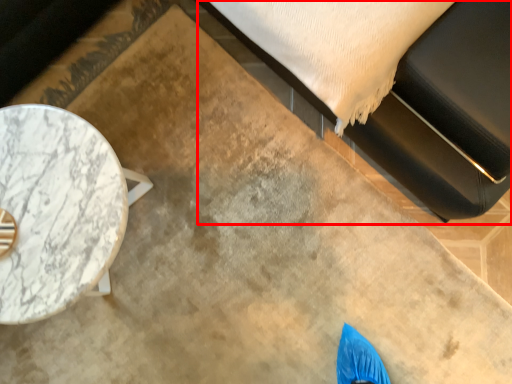
Question: From the image's perspective, what is the correct spatial positioning of bed (annotated by the red box) in reference to table?

Choices:
 (A) below
 (B) above

Answer: (B)